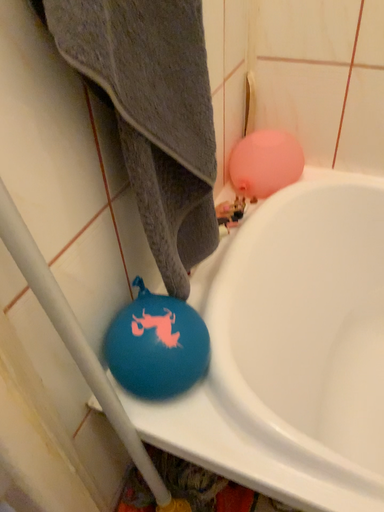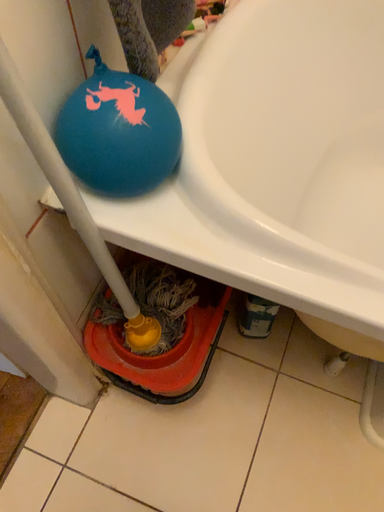
Question: Which way did the camera rotate in the video?

Choices:
 (A) rotated upward
 (B) rotated downward

Answer: (B)